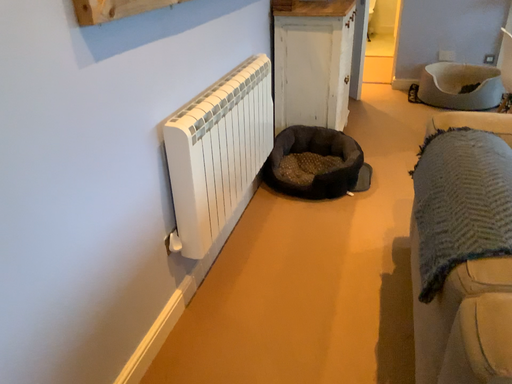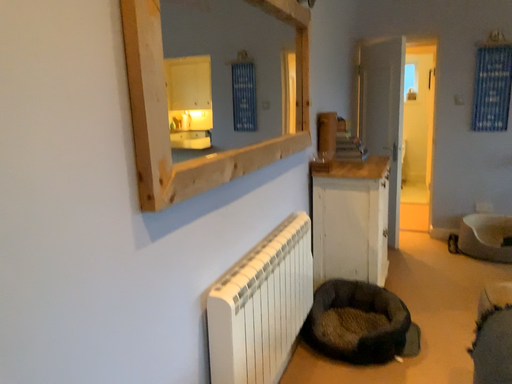
Question: How did the camera likely rotate when shooting the video?

Choices:
 (A) rotated upward
 (B) rotated downward

Answer: (A)